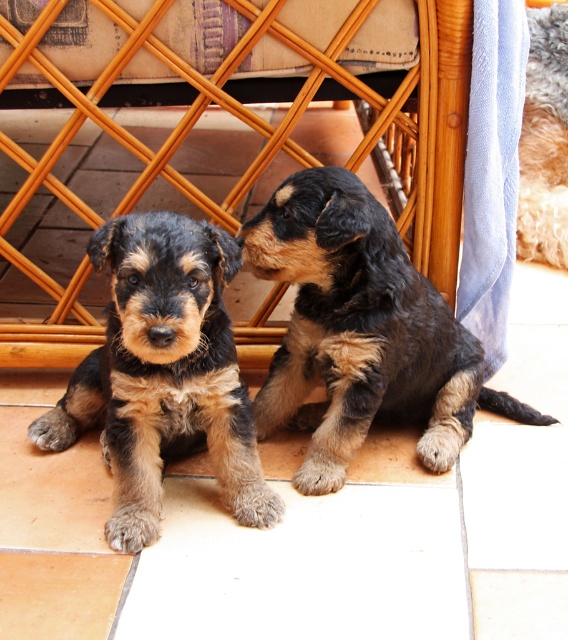
Can you confirm if brown fur puppy at center is smaller than fuzzy brown fur at center?

Actually, brown fur puppy at center might be larger than fuzzy brown fur at center.

Is brown fur puppy at center below fuzzy brown fur at center?

Yes, brown fur puppy at center is below fuzzy brown fur at center.

The width and height of the screenshot is (568, 640). Find the location of `brown fur puppy at center`. brown fur puppy at center is located at coordinates (164, 372).

Identify the location of brown fur puppy at center. This screenshot has width=568, height=640. (164, 372).

Who is lower down, black fur puppy at center or brown fur puppy at center?

brown fur puppy at center is below.

The height and width of the screenshot is (640, 568). What do you see at coordinates (361, 332) in the screenshot?
I see `black fur puppy at center` at bounding box center [361, 332].

In order to click on black fur puppy at center in this screenshot , I will do `click(361, 332)`.

Does woven wood chair at center lie behind brown fur puppy at center?

Yes, it is.

Is woven wood chair at center above brown fur puppy at center?

Yes.

The height and width of the screenshot is (640, 568). What do you see at coordinates (284, 116) in the screenshot?
I see `woven wood chair at center` at bounding box center [284, 116].

At what (x,y) coordinates should I click in order to perform the action: click on woven wood chair at center. Please return your answer as a coordinate pair (x, y). Image resolution: width=568 pixels, height=640 pixels. Looking at the image, I should click on (284, 116).